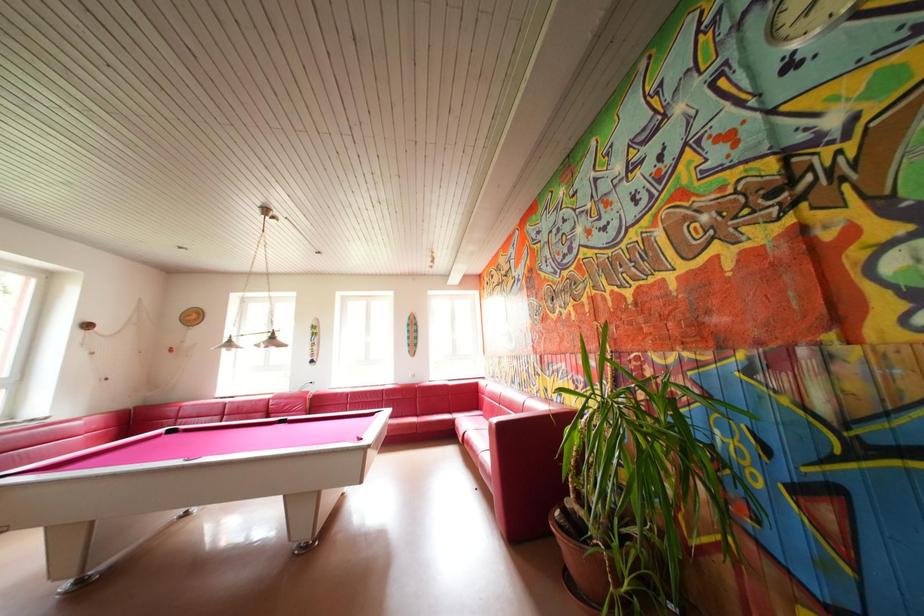
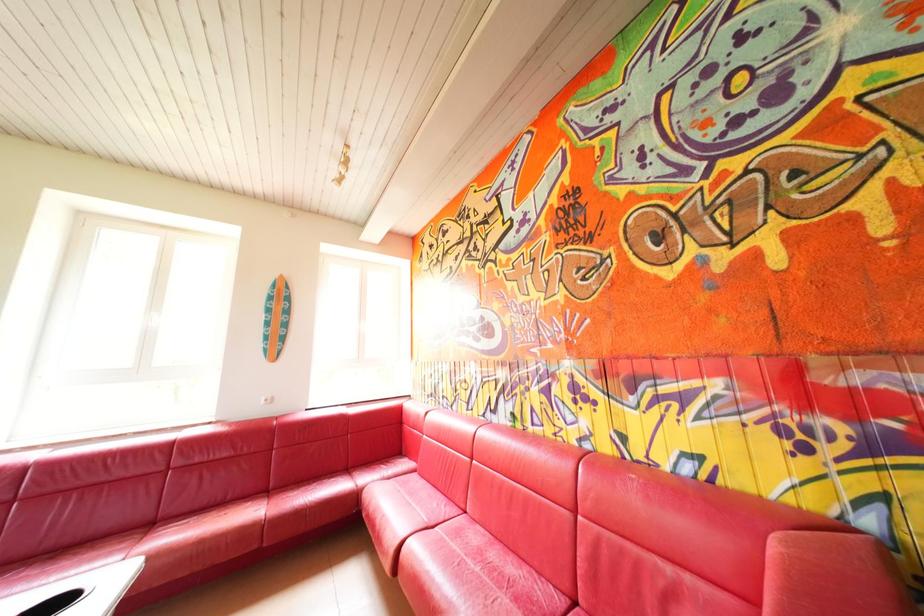
Question: Which direction would the cameraman need to move to produce the second image? Reply with the corresponding letter.

Choices:
 (A) Left
 (B) Right
 (C) Forward
 (D) Backward

Answer: (C)